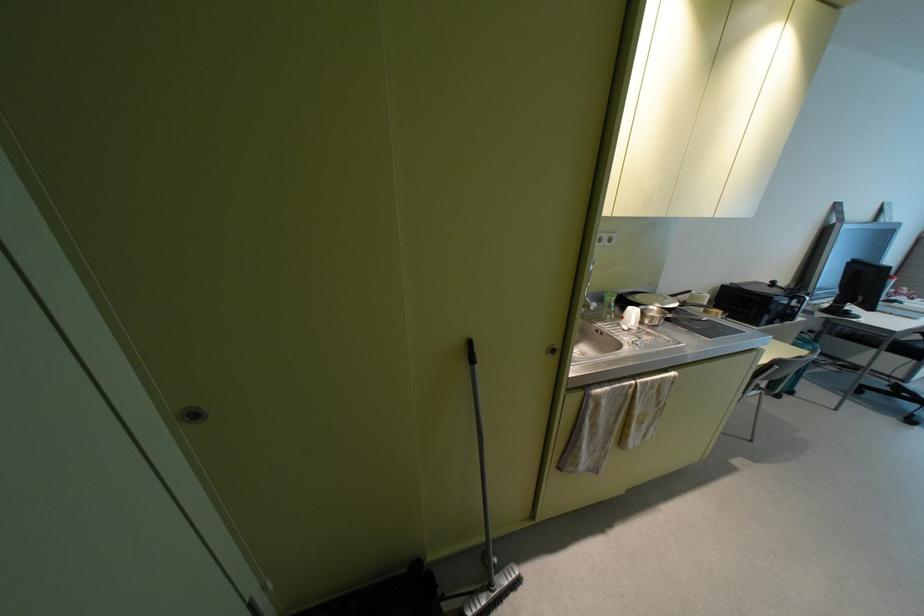
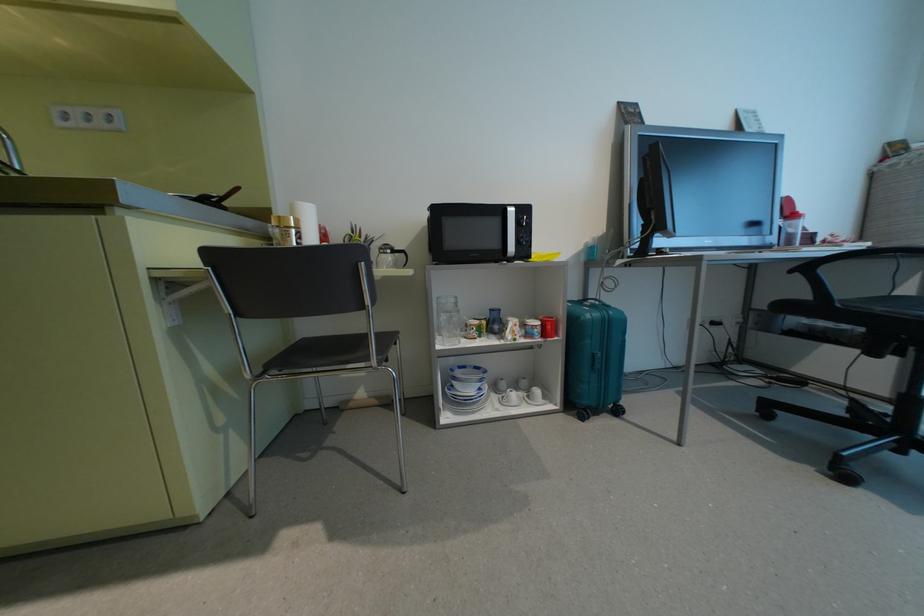
In a continuous first-person perspective shot, in which direction is the camera moving?

The cameraman walked toward right, forward.